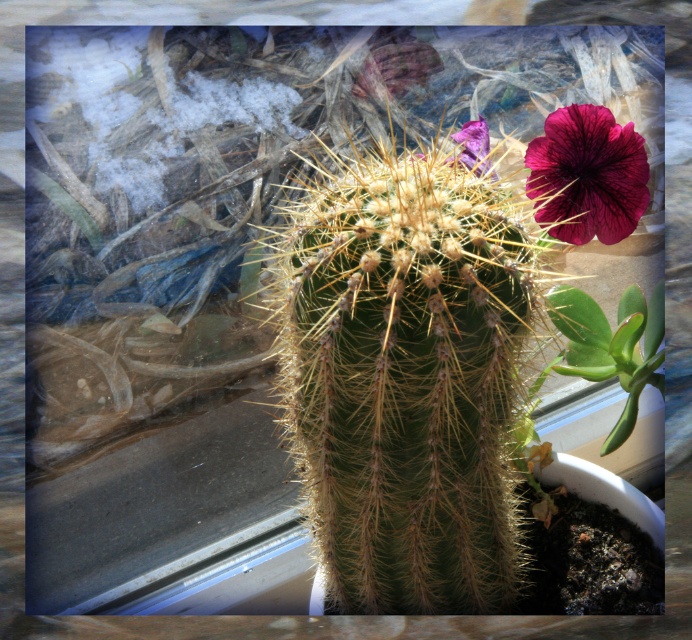
Question: Is dark purple petal at upper right thinner than purple matte flower at upper right?

Choices:
 (A) yes
 (B) no

Answer: (B)

Question: Which point is closer to the camera taking this photo?

Choices:
 (A) (583, 198)
 (B) (482, 168)

Answer: (B)

Question: Does dark purple petal at upper right have a lesser width compared to purple matte flower at upper right?

Choices:
 (A) yes
 (B) no

Answer: (B)

Question: Is dark purple petal at upper right smaller than purple matte flower at upper right?

Choices:
 (A) no
 (B) yes

Answer: (A)

Question: Among these points, which one is farthest from the camera?

Choices:
 (A) (x=576, y=156)
 (B) (x=462, y=134)

Answer: (B)